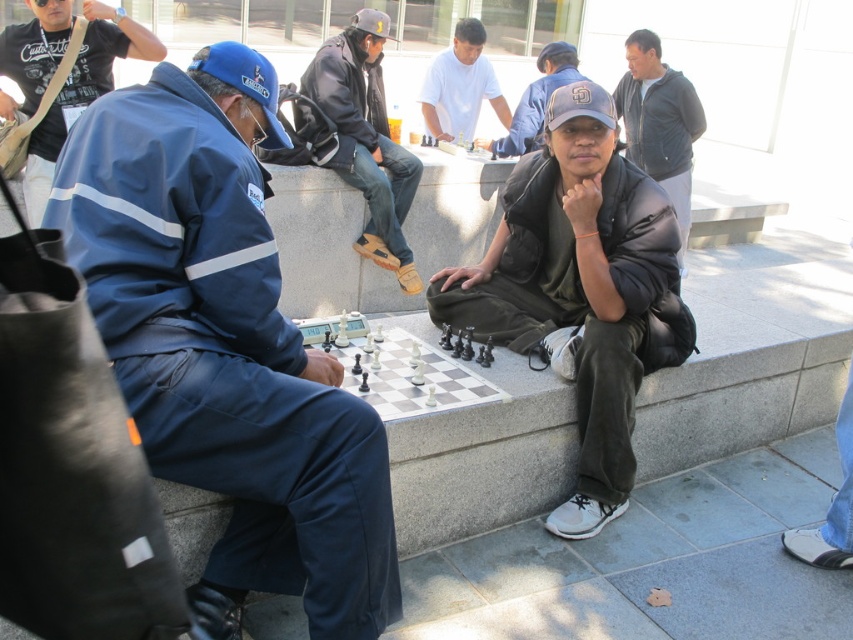
You are a photographer wanting to capture both the blue fabric jacket at left and the dark brown leather jacket at center in a single frame. Based on their positions, which jacket should you position closer to the left side of your camera viewfinder to include both?

The blue fabric jacket at left is already positioned to the left of the dark brown leather jacket at center, so you should keep the blue fabric jacket at left on the left side of the viewfinder to include both in the frame.

You are a photographer trying to capture a closeup of the chessboard without blocking the subjects. You notice two people nearby wearing the black matte jacket at center and the dark blue uniform at left. Which clothing item should you avoid standing behind to ensure a clear shot?

The black matte jacket at center is bigger than the dark blue uniform at left, so you should avoid standing behind the black matte jacket at center to ensure a clear shot.

You are standing in the park and see the chess game. There is a point at coordinates (225,344). Can you tell me what object this point is located on?

The point at coordinates (225,344) is located on the blue fabric jacket at left.